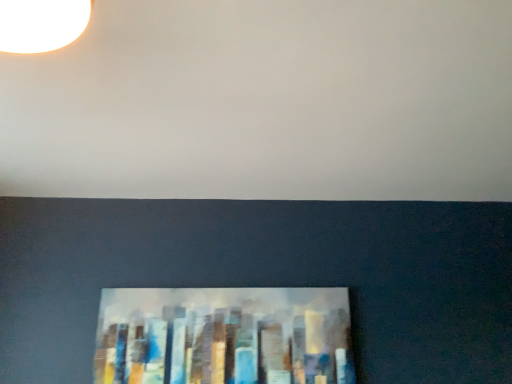
This screenshot has width=512, height=384. I want to click on metallic abstract painting at lower center, so click(x=224, y=336).

The height and width of the screenshot is (384, 512). What do you see at coordinates (224, 336) in the screenshot? I see `metallic abstract painting at lower center` at bounding box center [224, 336].

At what (x,y) coordinates should I click in order to perform the action: click on white matte wall at upper center. Please return your answer as a coordinate pair (x, y). The width and height of the screenshot is (512, 384). Looking at the image, I should click on (266, 103).

This screenshot has height=384, width=512. Describe the element at coordinates (266, 103) in the screenshot. I see `white matte wall at upper center` at that location.

You are a GUI agent. You are given a task and a screenshot of the screen. Output one action in this format:
    pyautogui.click(x=<x>, y=<y>)
    Task: Click on the metallic abstract painting at lower center
    
    Given the screenshot: What is the action you would take?
    pyautogui.click(x=224, y=336)

Which object is positioned more to the left, white matte wall at upper center or metallic abstract painting at lower center?

metallic abstract painting at lower center is more to the left.

From the picture: Who is more distant, white matte wall at upper center or metallic abstract painting at lower center?

metallic abstract painting at lower center is more distant.

Does point (233, 80) lie behind point (329, 315)?

No, it is in front of (329, 315).

Consider the image. From the image's perspective, between white matte wall at upper center and metallic abstract painting at lower center, which one is located above?

white matte wall at upper center appears higher in the image.

From a real-world perspective, who is located higher, white matte wall at upper center or metallic abstract painting at lower center?

In real-world perspective, white matte wall at upper center is above.

Is white matte wall at upper center wider than metallic abstract painting at lower center?

Yes, white matte wall at upper center is wider than metallic abstract painting at lower center.

Does white matte wall at upper center have a greater height compared to metallic abstract painting at lower center?

In fact, white matte wall at upper center may be shorter than metallic abstract painting at lower center.

Which of these two, white matte wall at upper center or metallic abstract painting at lower center, is smaller?

metallic abstract painting at lower center is smaller.

Is metallic abstract painting at lower center located within white matte wall at upper center?

No, metallic abstract painting at lower center is not surrounded by white matte wall at upper center.

Would you consider white matte wall at upper center to be distant from metallic abstract painting at lower center?

A: No, white matte wall at upper center is in close proximity to metallic abstract painting at lower center.

Is white matte wall at upper center oriented towards metallic abstract painting at lower center?

No, white matte wall at upper center does not turn towards metallic abstract painting at lower center.

The image size is (512, 384). I want to click on backdrop lying in front of the metallic abstract painting at lower center, so click(x=266, y=103).

Considering the positions of objects metallic abstract painting at lower center and white matte wall at upper center in the image provided, who is more to the right, metallic abstract painting at lower center or white matte wall at upper center?

white matte wall at upper center.

Which is in front, metallic abstract painting at lower center or white matte wall at upper center?

white matte wall at upper center is closer to the camera.

Considering the points (233, 359) and (504, 199), which point is behind, point (233, 359) or point (504, 199)?

The point (504, 199) is more distant.

From the image's perspective, which object appears higher, metallic abstract painting at lower center or white matte wall at upper center?

From the image's view, white matte wall at upper center is above.

From a real-world perspective, which object stands above the other?

white matte wall at upper center.

Considering the sizes of objects metallic abstract painting at lower center and white matte wall at upper center in the image provided, who is wider, metallic abstract painting at lower center or white matte wall at upper center?

white matte wall at upper center.

Does metallic abstract painting at lower center have a lesser height compared to white matte wall at upper center?

Incorrect, the height of metallic abstract painting at lower center does not fall short of that of white matte wall at upper center.

Looking at the image, does metallic abstract painting at lower center seem bigger or smaller compared to white matte wall at upper center?

Considering their sizes, metallic abstract painting at lower center takes up less space than white matte wall at upper center.

Choose the correct answer: Is metallic abstract painting at lower center inside white matte wall at upper center or outside it?

metallic abstract painting at lower center is outside white matte wall at upper center.

Does metallic abstract painting at lower center touch white matte wall at upper center?

No, metallic abstract painting at lower center is not beside white matte wall at upper center.

Is metallic abstract painting at lower center facing towards white matte wall at upper center?

No, metallic abstract painting at lower center is not oriented towards white matte wall at upper center.

Find the location of `picture frame below the white matte wall at upper center (from the image's perspective)`. picture frame below the white matte wall at upper center (from the image's perspective) is located at coordinates (224, 336).

I want to click on backdrop on the right of the metallic abstract painting at lower center, so click(266, 103).

This screenshot has height=384, width=512. I want to click on picture frame below the white matte wall at upper center (from the image's perspective), so click(224, 336).